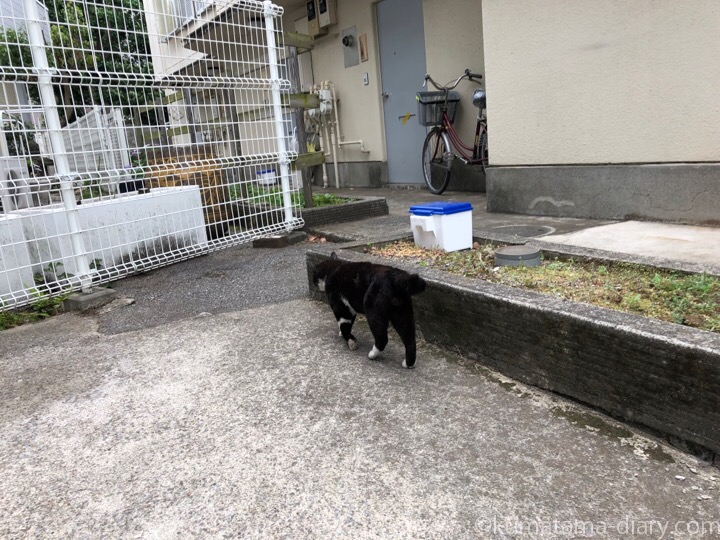
Locate an element on the screen. planter with grass is located at coordinates coord(608,283), coord(702,294), coord(453,255).